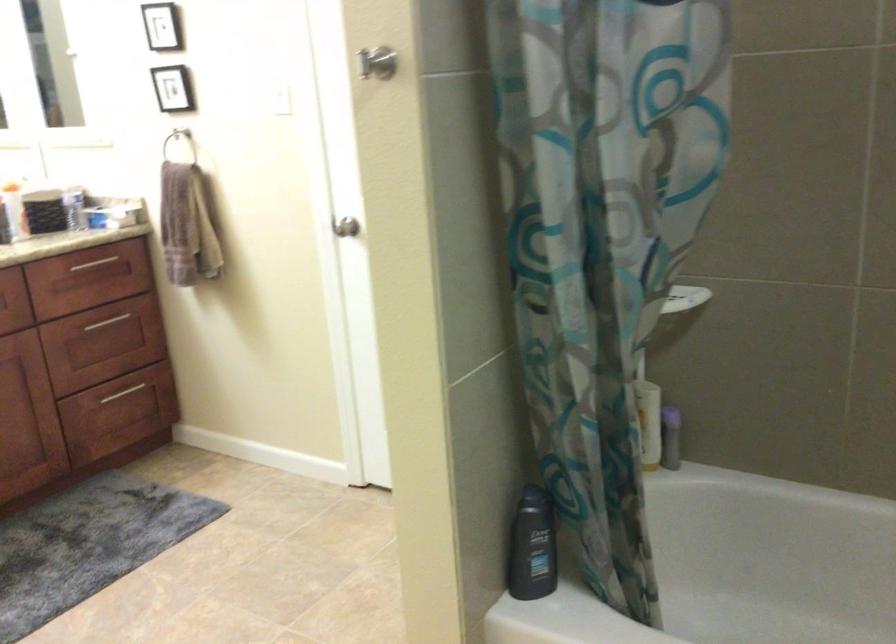
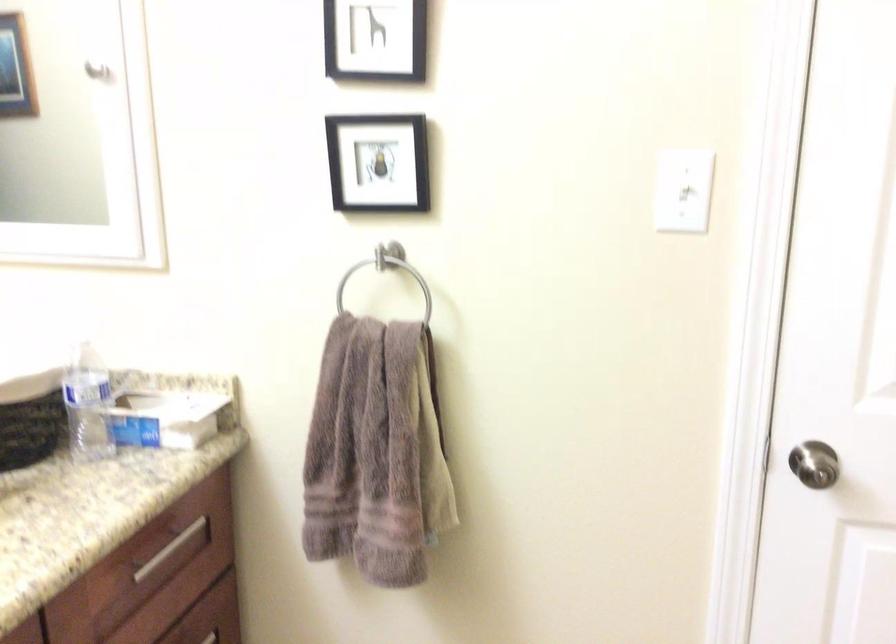
Where in the second image is the point corresponding to the point at 290,91 from the first image?

(683, 190)